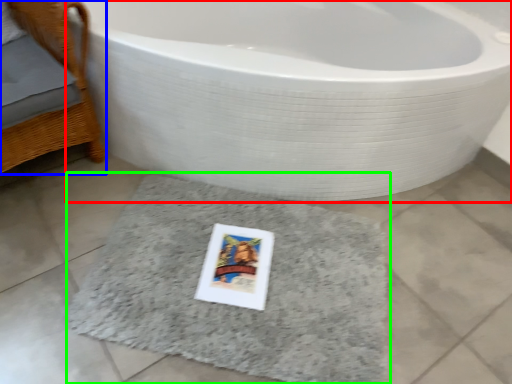
Question: Considering the real-world distances, which object is closest to bathtub (highlighted by a red box)? furniture (highlighted by a blue box) or bath mat (highlighted by a green box).

Choices:
 (A) furniture
 (B) bath mat

Answer: (B)